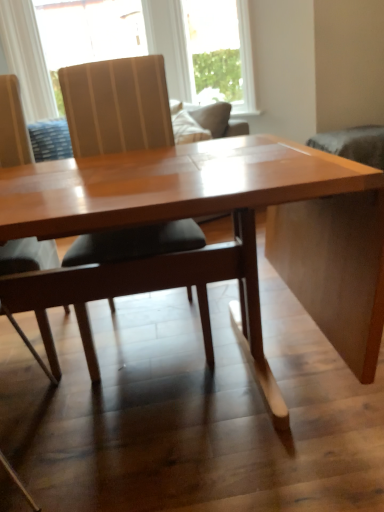
Question: Is clear glass window at upper center, the 2th window from the left, completely or partially outside of translucent fabric at upper center, the first window positioned from the left?

Choices:
 (A) yes
 (B) no

Answer: (A)

Question: Does clear glass window at upper center, which is the first window from right to left, have a lesser width compared to translucent fabric at upper center, the second window in the right-to-left sequence?

Choices:
 (A) yes
 (B) no

Answer: (A)

Question: Can you confirm if clear glass window at upper center, the 2th window from the left, is smaller than translucent fabric at upper center, the second window in the right-to-left sequence?

Choices:
 (A) yes
 (B) no

Answer: (A)

Question: Considering the relative positions of clear glass window at upper center, the 2th window from the left, and translucent fabric at upper center, the second window in the right-to-left sequence, in the image provided, is clear glass window at upper center, the 2th window from the left, behind translucent fabric at upper center, the second window in the right-to-left sequence,?

Choices:
 (A) no
 (B) yes

Answer: (A)

Question: Is clear glass window at upper center, the 2th window from the left, in front of translucent fabric at upper center, the first window positioned from the left?

Choices:
 (A) no
 (B) yes

Answer: (B)

Question: Is clear glass window at upper center, which is the first window from right to left, inside or outside of wooden table at center?

Choices:
 (A) inside
 (B) outside

Answer: (B)

Question: Based on their positions, is clear glass window at upper center, the 2th window from the left, located to the left or right of wooden table at center?

Choices:
 (A) left
 (B) right

Answer: (A)

Question: From the image's perspective, is clear glass window at upper center, the 2th window from the left, positioned above or below wooden table at center?

Choices:
 (A) above
 (B) below

Answer: (A)

Question: Does point (203, 45) appear closer or farther from the camera than point (266, 145)?

Choices:
 (A) closer
 (B) farther

Answer: (B)

Question: Is point (94, 161) positioned closer to the camera than point (49, 253)?

Choices:
 (A) farther
 (B) closer

Answer: (B)

Question: Is wooden table at center inside or outside of matte wood chair at left, the first chair in the left-to-right sequence?

Choices:
 (A) outside
 (B) inside

Answer: (A)

Question: From a real-world perspective, is wooden table at center physically located above or below matte wood chair at left, the first chair in the left-to-right sequence?

Choices:
 (A) above
 (B) below

Answer: (B)

Question: Considering the positions of wooden table at center and matte wood chair at left, which ranks as the second chair in right-to-left order, in the image, is wooden table at center taller or shorter than matte wood chair at left, which ranks as the second chair in right-to-left order,?

Choices:
 (A) short
 (B) tall

Answer: (A)

Question: Considering their positions, is translucent fabric at upper center, the second window in the right-to-left sequence, located in front of or behind clear glass window at upper center, which is the first window from right to left?

Choices:
 (A) behind
 (B) front

Answer: (A)

Question: From a real-world perspective, is translucent fabric at upper center, the second window in the right-to-left sequence, above or below clear glass window at upper center, which is the first window from right to left?

Choices:
 (A) below
 (B) above

Answer: (B)